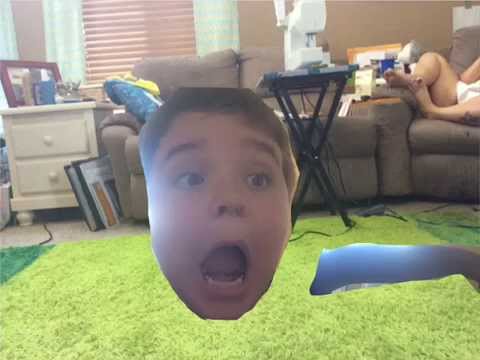
Identify the location of pillow. (139, 106).